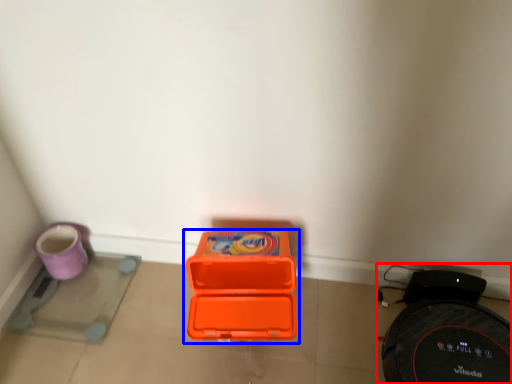
Question: Which point is closer to the camera, appliance (highlighted by a red box) or box (highlighted by a blue box)?

Choices:
 (A) appliance
 (B) box

Answer: (A)